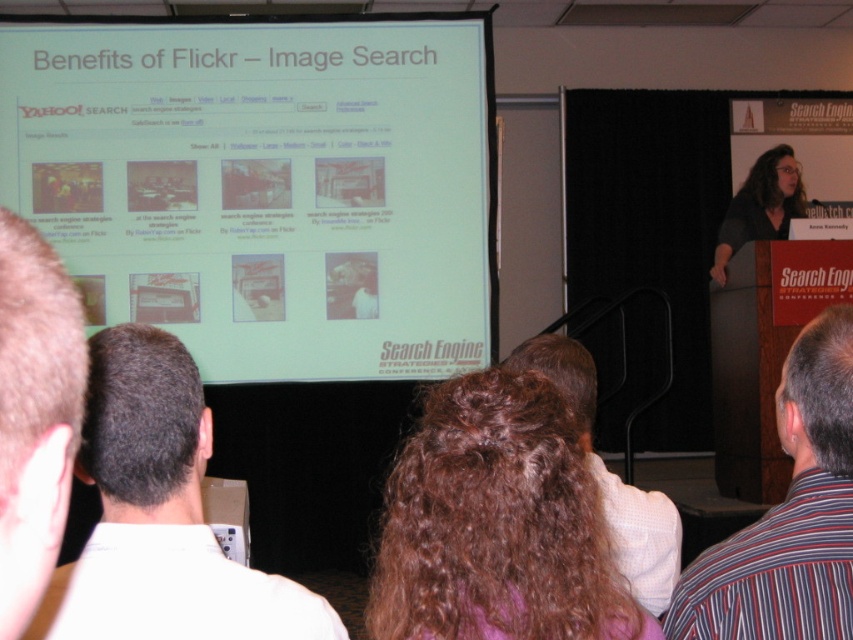
Does white matte projection screen at upper center come in front of white shirt at upper left?

That is False.

Does white matte projection screen at upper center appear over white shirt at upper left?

Yes, white matte projection screen at upper center is above white shirt at upper left.

Who is more forward, (422, 148) or (177, 499)?

Point (177, 499) is more forward.

At what (x,y) coordinates should I click in order to perform the action: click on white matte projection screen at upper center. Please return your answer as a coordinate pair (x, y). Looking at the image, I should click on (264, 184).

Which is behind, point (386, 480) or point (778, 211)?

The point (778, 211) is more distant.

Is curly brown hair at center bigger than matte black hair at right?

No, curly brown hair at center is not bigger than matte black hair at right.

Where is `curly brown hair at center`? Image resolution: width=853 pixels, height=640 pixels. curly brown hair at center is located at coordinates (497, 524).

You are a GUI agent. You are given a task and a screenshot of the screen. Output one action in this format:
    pyautogui.click(x=<x>, y=<y>)
    Task: Click on the curly brown hair at center
    The image size is (853, 640).
    Given the screenshot: What is the action you would take?
    pyautogui.click(x=497, y=524)

Between white shirt at upper left and brown hair at left, which one appears on the left side from the viewer's perspective?

white shirt at upper left is more to the left.

Between white shirt at upper left and brown hair at left, which one has more height?

white shirt at upper left is taller.

I want to click on white shirt at upper left, so click(160, 515).

I want to click on white shirt at upper left, so click(160, 515).